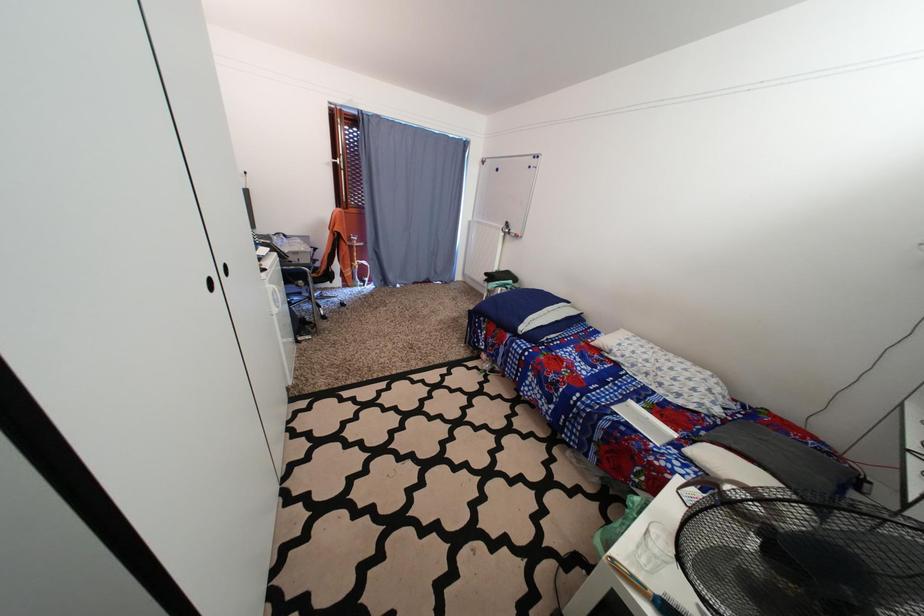
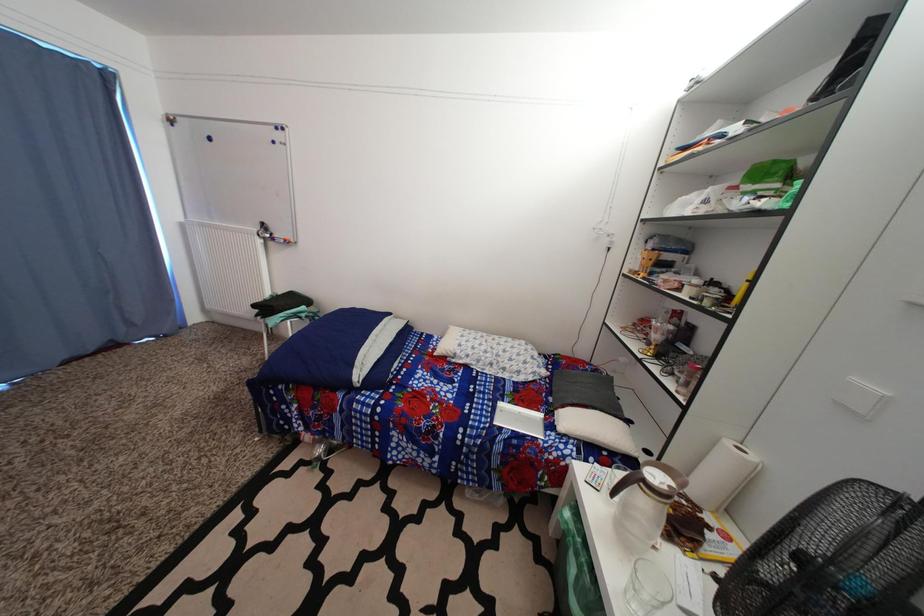
Question: How did the camera likely rotate?

Choices:
 (A) Left
 (B) Right
 (C) Up
 (D) Down

Answer: (B)